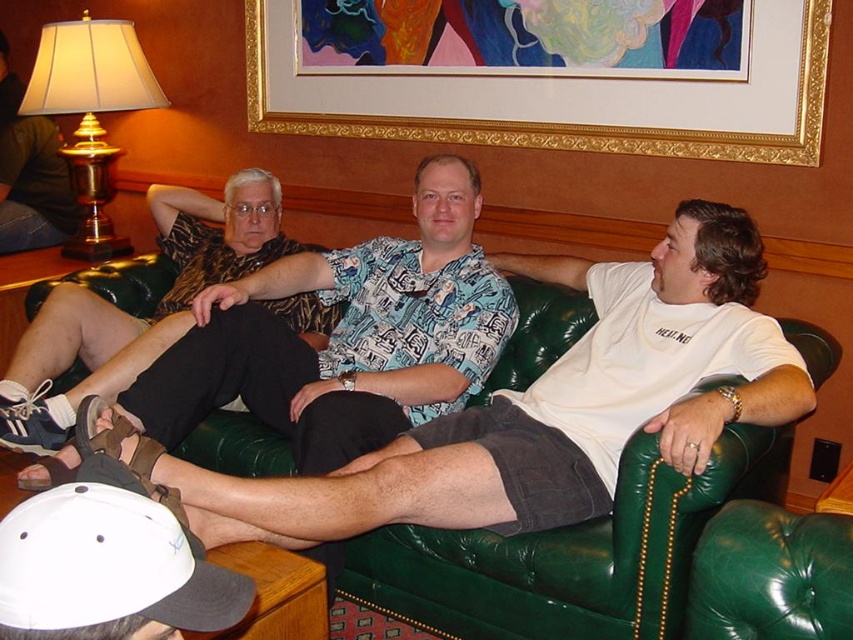
You are standing in front of the green leather couch at center and want to place a 1.5 meter long decorative pillow on it. Can you determine if the pillow will fit on the couch?

The green leather couch at center is 1.63 meters from viewer, so the distance is not directly related to the couch length. The question about the pillow fitting requires knowing the couch length, which is not provided in the description. Therefore, it is impossible to determine if the pillow will fit based on the given information.

You are an interior designer planning to replace the green leather couch at center with a smaller one. Considering the current size of the gold metallic lampshade at upper left, will the new couch still be larger than the lampshade?

The green leather couch at center is currently bigger than the gold metallic lampshade at upper left. If you replace it with a smaller couch, it might no longer be larger than the lampshade depending on the new size chosen.